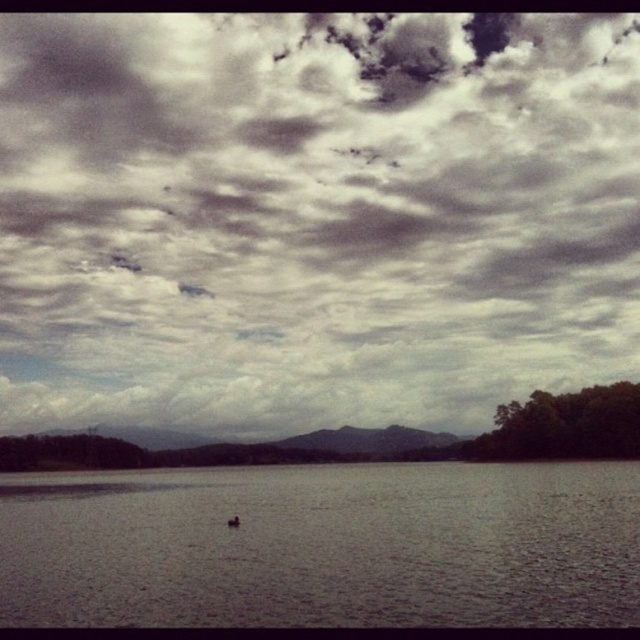
Question: Which point is closer to the camera?

Choices:
 (A) (404, 298)
 (B) (125, 556)

Answer: (B)

Question: Which object appears farthest from the camera in this image?

Choices:
 (A) gray matte water at center
 (B) cloudy sky at upper center

Answer: (B)

Question: Is cloudy sky at upper center to the right of gray matte water at center from the viewer's perspective?

Choices:
 (A) no
 (B) yes

Answer: (A)

Question: Is cloudy sky at upper center to the left of gray matte water at center from the viewer's perspective?

Choices:
 (A) no
 (B) yes

Answer: (B)

Question: Which point is farther to the camera?

Choices:
 (A) (576, 547)
 (B) (513, 340)

Answer: (B)

Question: Can you confirm if cloudy sky at upper center is wider than gray matte water at center?

Choices:
 (A) no
 (B) yes

Answer: (B)